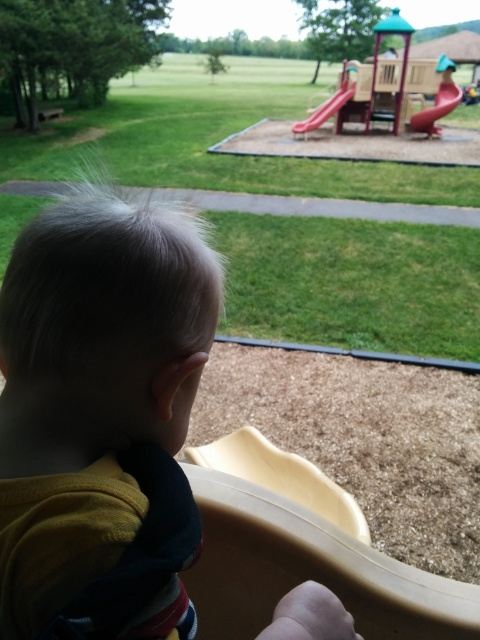
Question: Which point appears closest to the camera in this image?

Choices:
 (A) (434, 115)
 (B) (319, 108)
 (C) (12, 324)

Answer: (C)

Question: Does yellow cotton shirt at lower left have a lesser width compared to smooth red slide at upper right?

Choices:
 (A) yes
 (B) no

Answer: (A)

Question: Which of the following is the closest to the observer?

Choices:
 (A) (447, 81)
 (B) (307, 120)
 (C) (86, 568)

Answer: (C)

Question: Among these objects, which one is nearest to the camera?

Choices:
 (A) smooth plastic slide at center
 (B) smooth red slide at upper right
 (C) yellow cotton shirt at lower left

Answer: (C)

Question: From the image, what is the correct spatial relationship of yellow cotton shirt at lower left in relation to smooth plastic slide at center?

Choices:
 (A) above
 (B) below

Answer: (B)

Question: Considering the relative positions of yellow cotton shirt at lower left and smooth red slide at upper right in the image provided, where is yellow cotton shirt at lower left located with respect to smooth red slide at upper right?

Choices:
 (A) left
 (B) right

Answer: (A)